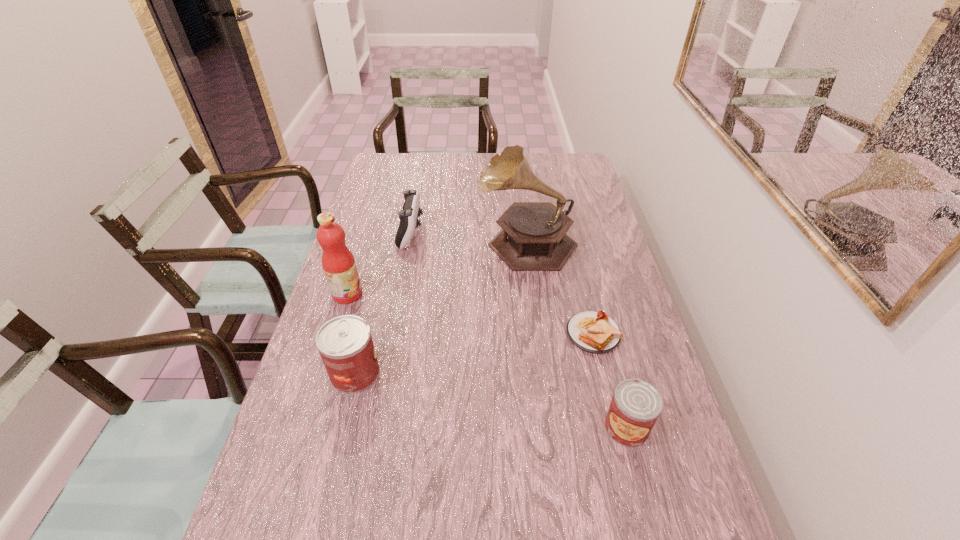
To ensure equal spacing by inserting another can among them, please point out a vacant spot for this new can. Please provide its 2D coordinates. Your answer should be formatted as a tuple, i.e. [(x, y)], where the tuple contains the x and y coordinates of a point satisfying the conditions above.

[(484, 399)]